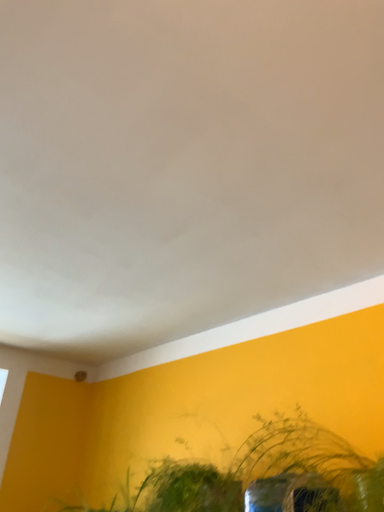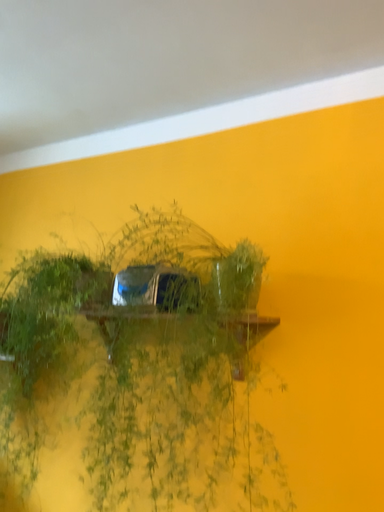
Question: How did the camera likely rotate when shooting the video?

Choices:
 (A) rotated downward
 (B) rotated upward

Answer: (A)